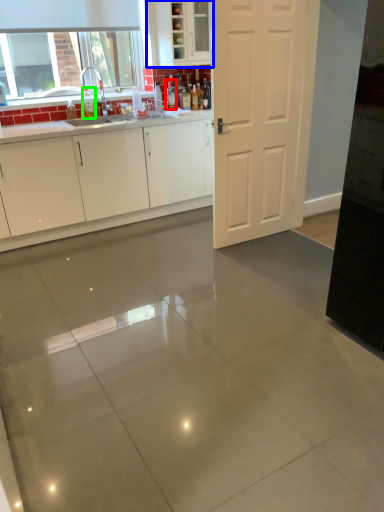
Question: Which object is the farthest from bottle (highlighted by a red box)? Choose among these: cabinetry (highlighted by a blue box) or bottle (highlighted by a green box).

Choices:
 (A) cabinetry
 (B) bottle

Answer: (B)